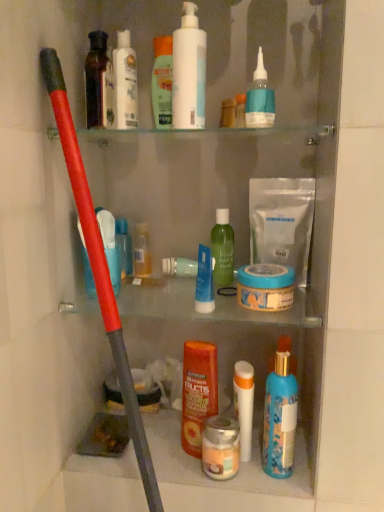
Question: From a real-world perspective, is green matte lotion at upper center, arranged as the 7th toiletry when viewed from the right, positioned over white matte pump bottle at upper center based on gravity?

Choices:
 (A) no
 (B) yes

Answer: (A)

Question: Is green matte lotion at upper center, arranged as the 7th toiletry when viewed from the right, not inside white matte pump bottle at upper center?

Choices:
 (A) no
 (B) yes

Answer: (B)

Question: Is green matte lotion at upper center, which is the fifth toiletry in left-to-right order, turned away from white matte pump bottle at upper center?

Choices:
 (A) yes
 (B) no

Answer: (B)

Question: Considering the relative positions of green matte lotion at upper center, which is the fifth toiletry in left-to-right order, and white matte pump bottle at upper center in the image provided, is green matte lotion at upper center, which is the fifth toiletry in left-to-right order, to the left of white matte pump bottle at upper center from the viewer's perspective?

Choices:
 (A) no
 (B) yes

Answer: (B)

Question: From the image's perspective, is green matte lotion at upper center, arranged as the 7th toiletry when viewed from the right, located above white matte pump bottle at upper center?

Choices:
 (A) no
 (B) yes

Answer: (B)

Question: Considering the relative positions of green matte lotion at upper center, which is the fifth toiletry in left-to-right order, and white matte pump bottle at upper center in the image provided, is green matte lotion at upper center, which is the fifth toiletry in left-to-right order, to the right of white matte pump bottle at upper center from the viewer's perspective?

Choices:
 (A) yes
 (B) no

Answer: (B)

Question: Is blue matte jar at center facing away from white matte tube at center, which appears as the third toiletry when viewed from the right?

Choices:
 (A) yes
 (B) no

Answer: (B)

Question: Considering the relative positions of blue matte jar at center and white matte tube at center, which appears as the third toiletry when viewed from the right, in the image provided, is blue matte jar at center to the left of white matte tube at center, which appears as the third toiletry when viewed from the right, from the viewer's perspective?

Choices:
 (A) yes
 (B) no

Answer: (B)

Question: From the image's perspective, would you say blue matte jar at center is positioned over white matte tube at center, which appears as the third toiletry when viewed from the right?

Choices:
 (A) no
 (B) yes

Answer: (B)

Question: From a real-world perspective, is blue matte jar at center on top of white matte tube at center, which ranks as the ninth toiletry in left-to-right order?

Choices:
 (A) yes
 (B) no

Answer: (A)

Question: Is blue matte jar at center smaller than white matte tube at center, which appears as the third toiletry when viewed from the right?

Choices:
 (A) yes
 (B) no

Answer: (B)

Question: Is blue matte jar at center taller than white matte tube at center, which appears as the third toiletry when viewed from the right?

Choices:
 (A) no
 (B) yes

Answer: (A)

Question: Does green matte lotion at upper center, arranged as the 7th toiletry when viewed from the right, have a larger size compared to blue glossy spray bottle at lower center, which is the first toiletry in right-to-left order?

Choices:
 (A) no
 (B) yes

Answer: (A)